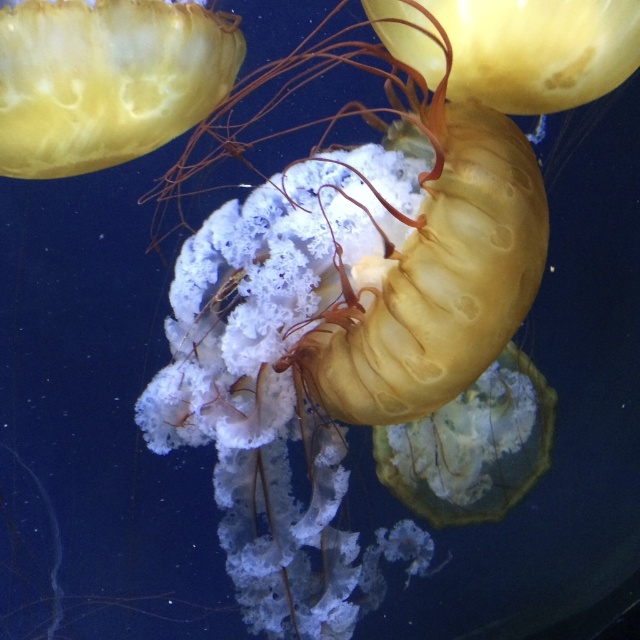
Question: Among these points, which one is farthest from the camera?

Choices:
 (A) (52, 24)
 (B) (529, 90)

Answer: (B)

Question: Is translucent yellow jellyfish at upper left positioned behind translucent yellow jellyfish at upper center?

Choices:
 (A) yes
 (B) no

Answer: (A)

Question: Does translucent yellow jellyfish at upper left have a smaller size compared to translucent yellow jellyfish at upper center?

Choices:
 (A) yes
 (B) no

Answer: (B)

Question: Does translucent yellow jellyfish at upper left have a smaller size compared to translucent yellow jellyfish at upper center?

Choices:
 (A) yes
 (B) no

Answer: (B)

Question: Among these points, which one is nearest to the camera?

Choices:
 (A) (29, 134)
 (B) (512, 90)

Answer: (B)